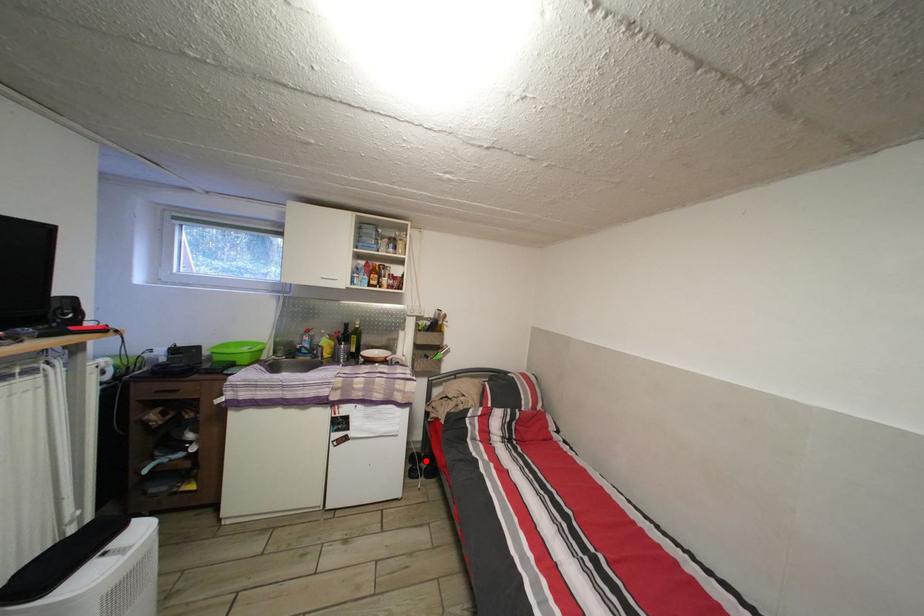
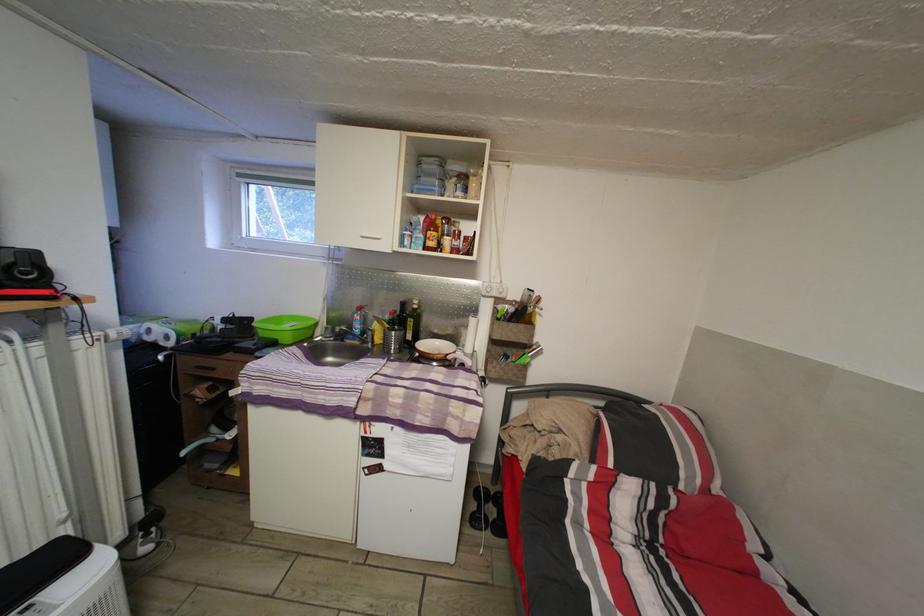
Question: I am providing you with two images of the same scene from different viewpoints. Given a red point in image1, look at the same physical point in image2. Is it:

Choices:
 (A) Closer to the viewpoint
 (B) Farther from the viewpoint

Answer: (A)